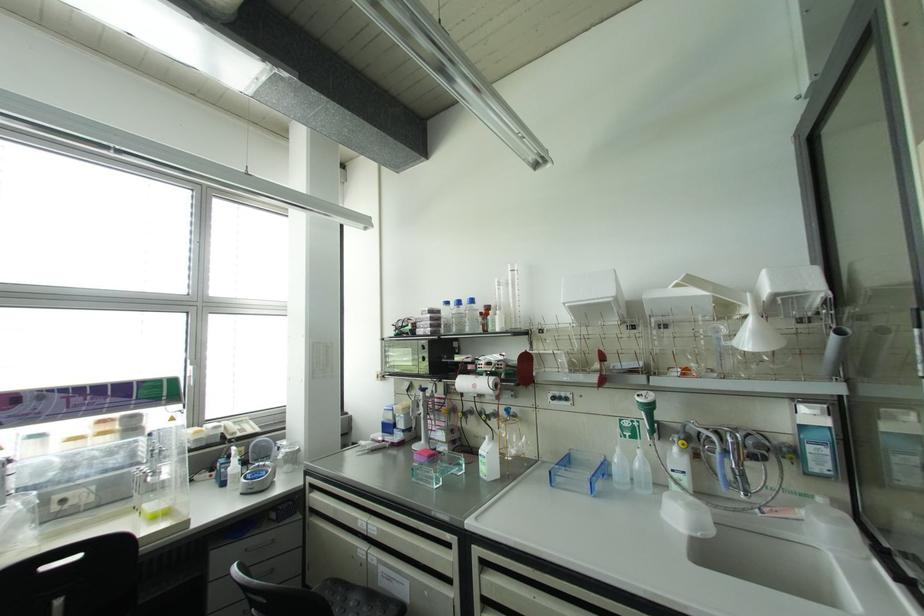
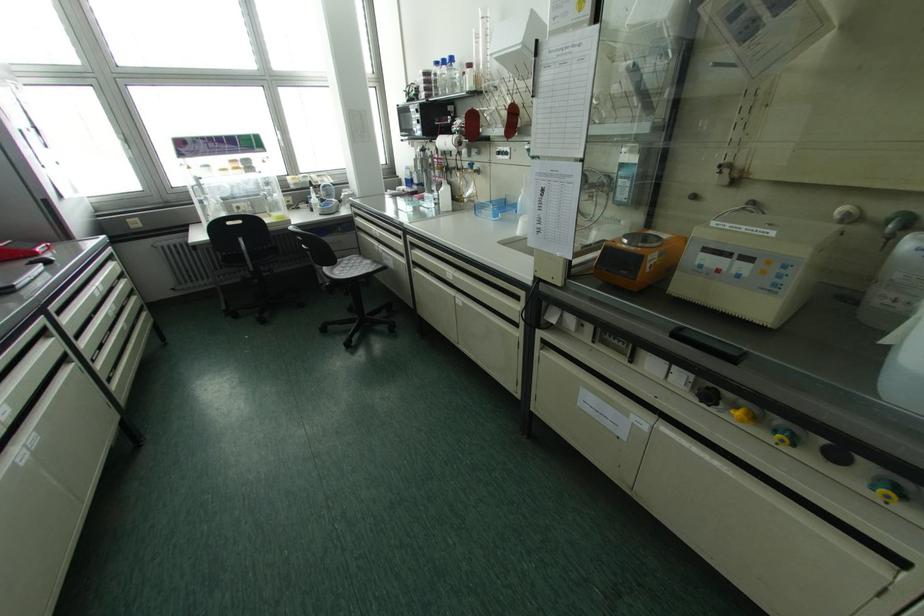
In the second image, find the point that corresponds to point (553, 398) in the first image.

(497, 153)